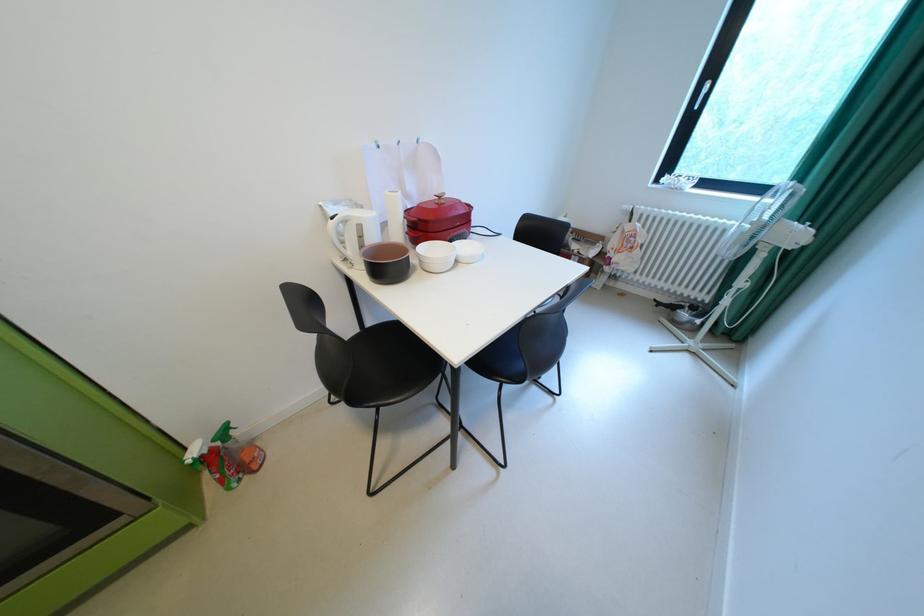
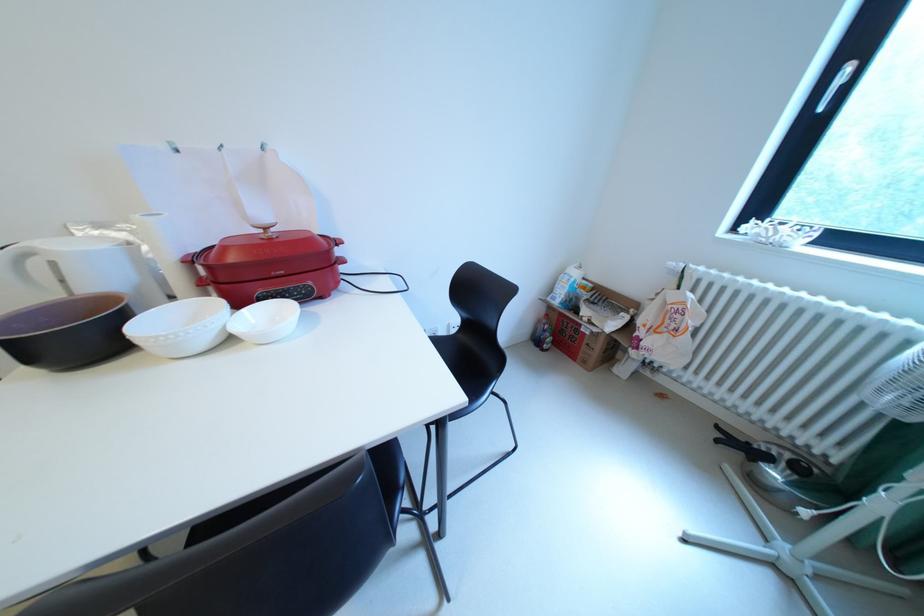
The point at (447, 203) is marked in the first image. Where is the corresponding point in the second image?

(273, 237)